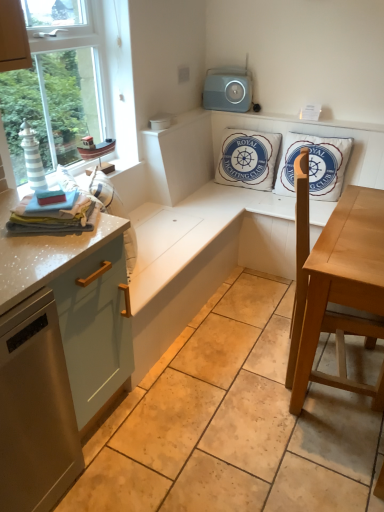
Locate an element on the screen. The height and width of the screenshot is (512, 384). free point below light brown wooden table at center (from a real-world perspective) is located at coordinates (331, 367).